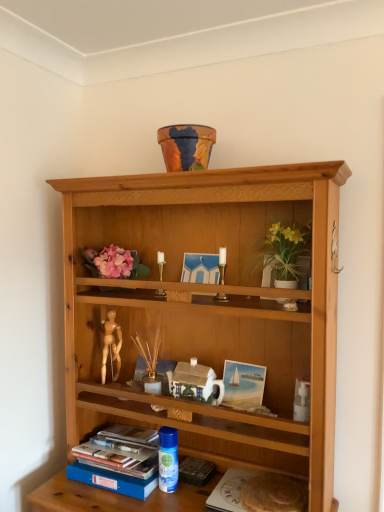
Question: Considering the relative sizes of white ceramic vase at upper center and gold metallic candle holder at center, positioned as the 1th candle holder in front-to-back order, in the image provided, is white ceramic vase at upper center thinner than gold metallic candle holder at center, positioned as the 1th candle holder in front-to-back order,?

Choices:
 (A) yes
 (B) no

Answer: (B)

Question: Is white ceramic vase at upper center taller than gold metallic candle holder at center, which is counted as the 1th candle holder, starting from the right?

Choices:
 (A) no
 (B) yes

Answer: (B)

Question: Could you tell me if white ceramic vase at upper center is turned towards gold metallic candle holder at center, which is the second candle holder in back-to-front order?

Choices:
 (A) yes
 (B) no

Answer: (B)

Question: Can you confirm if white ceramic vase at upper center is wider than gold metallic candle holder at center, positioned as the 1th candle holder in front-to-back order?

Choices:
 (A) no
 (B) yes

Answer: (B)

Question: Is white ceramic vase at upper center looking in the opposite direction of gold metallic candle holder at center, the 2th candle holder viewed from the left?

Choices:
 (A) no
 (B) yes

Answer: (A)

Question: Are white ceramic vase at upper center and gold metallic candle holder at center, the 2th candle holder viewed from the left, far apart?

Choices:
 (A) yes
 (B) no

Answer: (B)

Question: Considering the relative sizes of white matte paper at lower center and white ceramic house at center in the image provided, is white matte paper at lower center bigger than white ceramic house at center?

Choices:
 (A) no
 (B) yes

Answer: (B)

Question: Does white matte paper at lower center touch white ceramic house at center?

Choices:
 (A) yes
 (B) no

Answer: (B)

Question: Can you confirm if white matte paper at lower center is smaller than white ceramic house at center?

Choices:
 (A) no
 (B) yes

Answer: (A)

Question: Would you say white matte paper at lower center is outside white ceramic house at center?

Choices:
 (A) no
 (B) yes

Answer: (B)

Question: Does white matte paper at lower center lie in front of white ceramic house at center?

Choices:
 (A) yes
 (B) no

Answer: (A)

Question: Is white matte paper at lower center thinner than white ceramic house at center?

Choices:
 (A) yes
 (B) no

Answer: (B)

Question: Can you see white ceramic vase at upper center touching blue plastic spray can at lower center?

Choices:
 (A) yes
 (B) no

Answer: (B)